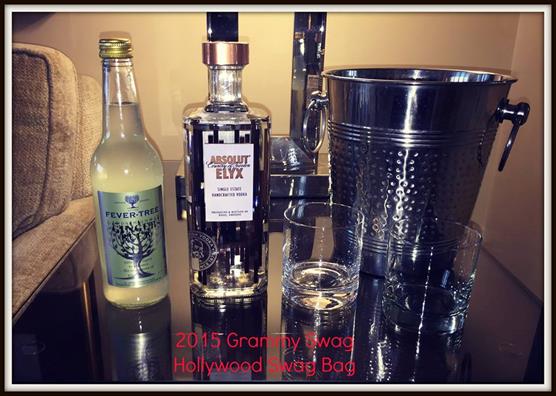
The image size is (556, 396). Find the location of `right couch pillow and arm rest`. right couch pillow and arm rest is located at coordinates (34, 146).